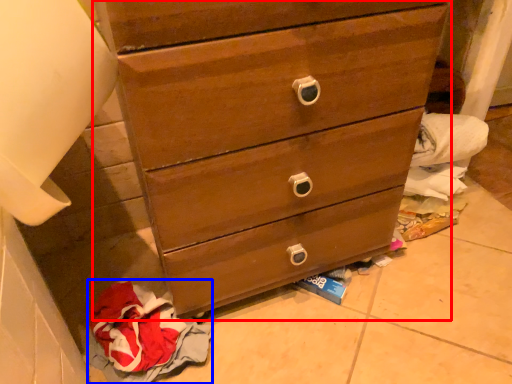
Question: Among these objects, which one is nearest to the camera, chest of drawers (highlighted by a red box) or baby clothe (highlighted by a blue box)?

Choices:
 (A) chest of drawers
 (B) baby clothe

Answer: (A)